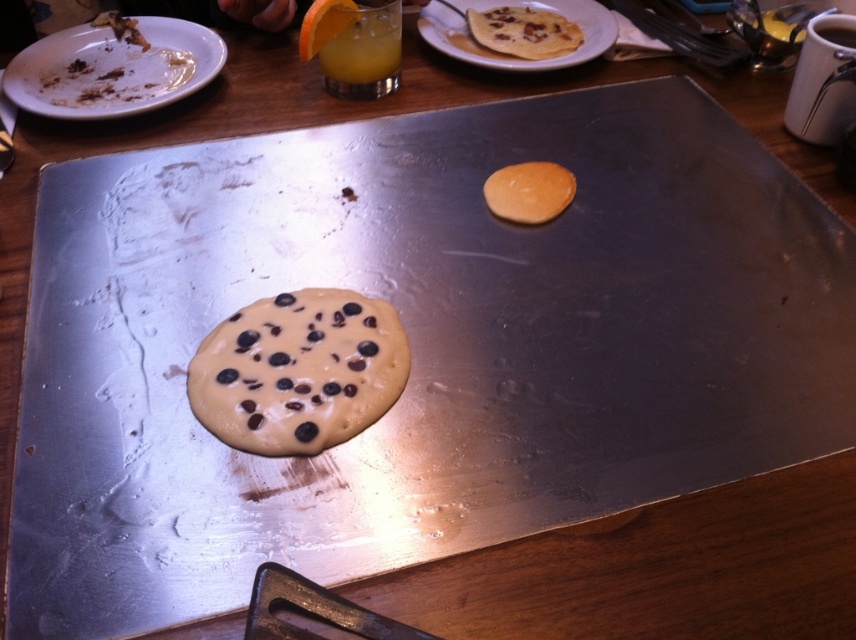
Question: Among these objects, which one is farthest from the camera?

Choices:
 (A) translucent glass orange juice at center
 (B) white matte plate at upper left
 (C) golden pancake at upper center
 (D) orange liquid at center

Answer: (C)

Question: Is orange liquid at center wider than translucent glass orange juice at center?

Choices:
 (A) yes
 (B) no

Answer: (A)

Question: Does white matte plate at upper left appear on the left side of translucent glass orange juice at center?

Choices:
 (A) yes
 (B) no

Answer: (A)

Question: Which point is farther from the camera taking this photo?

Choices:
 (A) (503, 67)
 (B) (372, 93)
 (C) (313, 16)
 (D) (524, 28)

Answer: (D)

Question: Estimate the real-world distances between objects in this image. Which object is farther from the chocolate chip pancake at center?

Choices:
 (A) orange liquid at center
 (B) golden brown crispy pancake at upper right
 (C) golden pancake at upper center
 (D) white matte plate at upper left

Answer: (B)

Question: From the image, what is the correct spatial relationship of chocolate chip pancake at center in relation to translucent glass orange juice at center?

Choices:
 (A) above
 (B) below

Answer: (B)